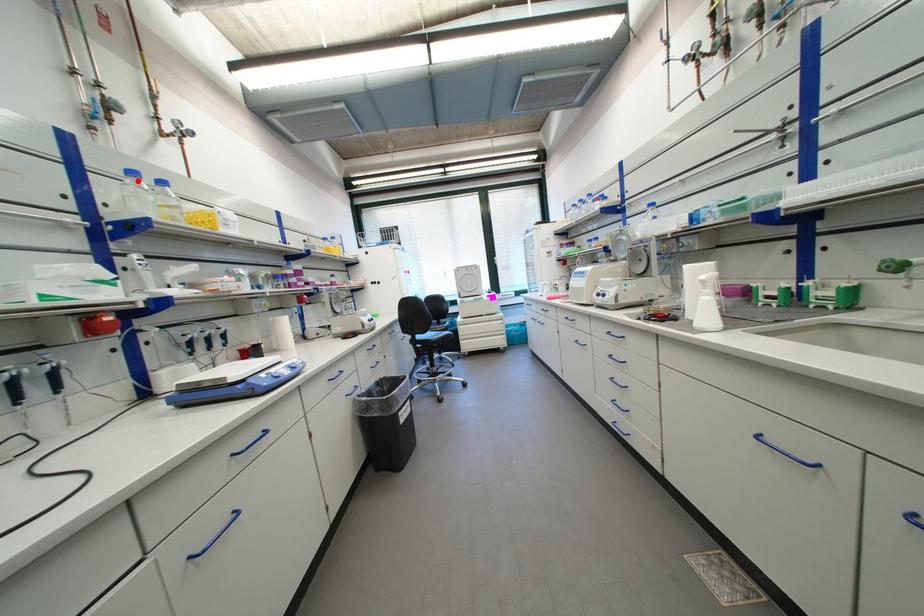
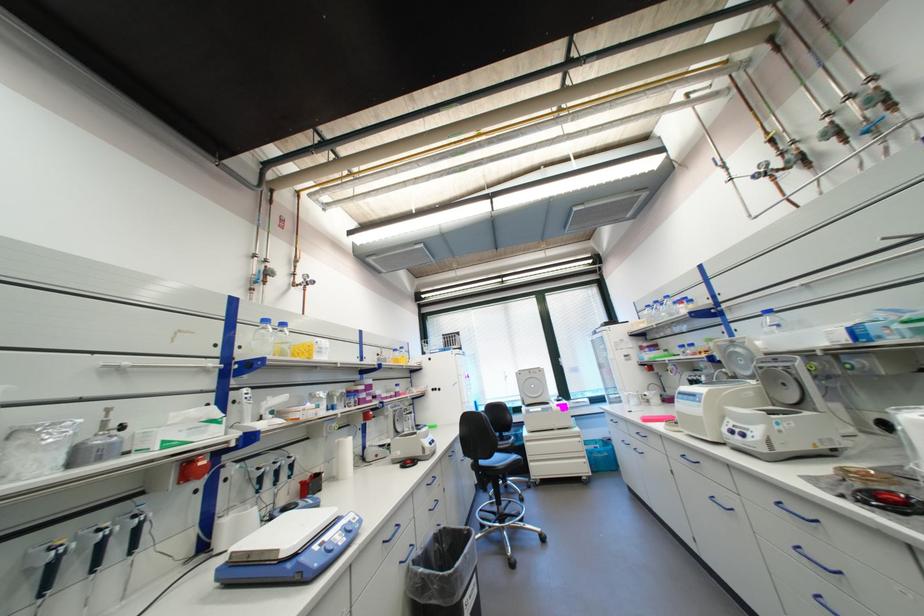
The point at the highlighted location is marked in the first image. Where is the corresponding point in the second image?

(271, 326)